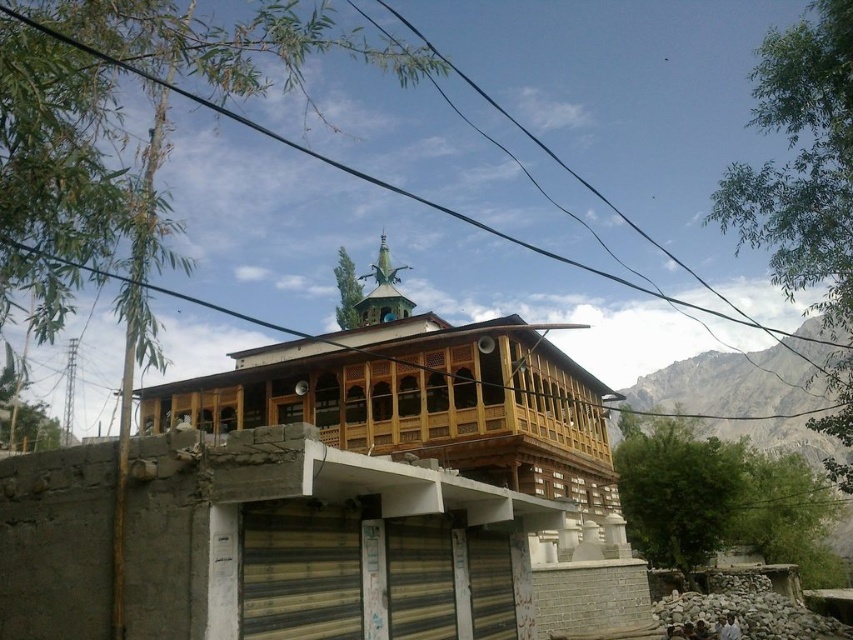
Identify the location of wooden mosque at center. The width and height of the screenshot is (853, 640). (335, 499).

Looking at this image, which of these two, wooden mosque at center or black wire at upper center, stands shorter?

With less height is wooden mosque at center.

Which is in front, point (173, 540) or point (651, 320)?

Point (173, 540)

Find the location of a particular element. This screenshot has height=640, width=853. wooden mosque at center is located at coordinates (335, 499).